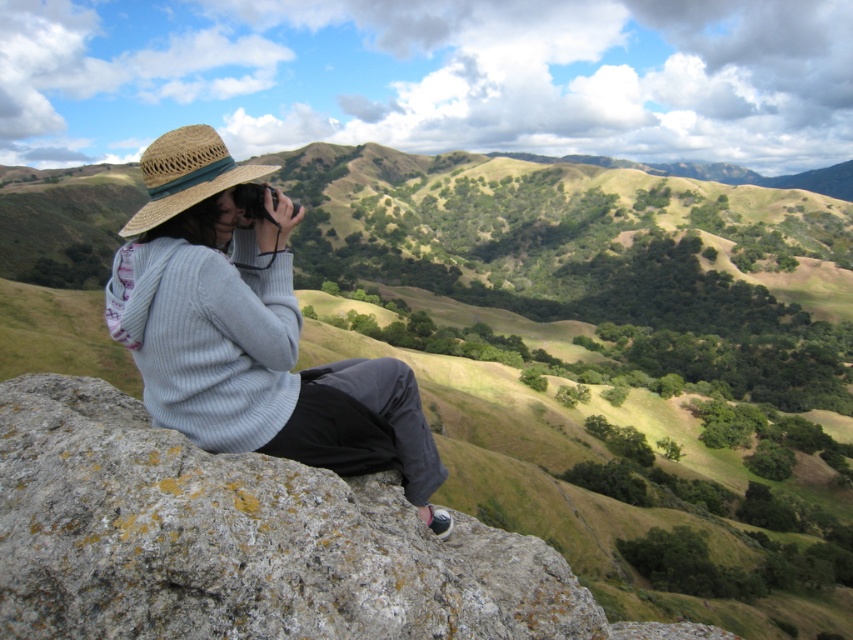
You are a photographer standing at the edge of the rocky outcrop. You notice the gray rough rock at center and the straw hat at left. Which object is closer to your current position?

The gray rough rock at center is 2.11 meters away from the straw hat at left. Since you are standing at the edge of the rocky outcrop, the gray rough rock at center is likely closer to your position than the straw hat at left.

You are the photographer in the scene and want to focus on the point closer to you. Which point should you choose between point (392, 616) and point (299, 422)?

Point (392, 616) is closer to the camera than point (299, 422), so you should choose point (392, 616) to focus on.

You are standing at the point marked by the coordinates point [238,540] in the image. What is the object you are standing on?

The point [238,540] marks gray rough rock at center, so you are standing on the gray rough rock at center.